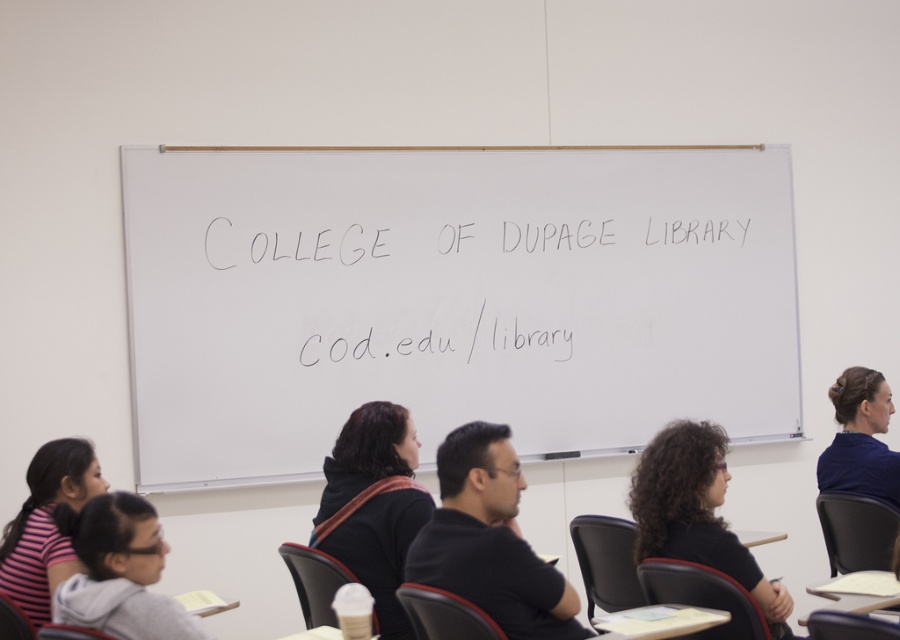
Question: Observing the image, what is the correct spatial positioning of black matte shirt at center in reference to black matte jacket at center?

Choices:
 (A) above
 (B) below

Answer: (B)

Question: Is white chalk writing at center to the left of black matte shirt at center from the viewer's perspective?

Choices:
 (A) no
 (B) yes

Answer: (A)

Question: Which point is closer to the camera taking this photo?

Choices:
 (A) (369, 584)
 (B) (560, 588)
 (C) (159, 532)
 (D) (307, 305)

Answer: (B)

Question: Which object is farther from the camera taking this photo?

Choices:
 (A) black matte jacket at center
 (B) black matte shirt at center

Answer: (A)

Question: Which of the following is the farthest from the observer?

Choices:
 (A) (464, 525)
 (B) (549, 307)
 (C) (349, 545)
 (D) (58, 506)

Answer: (B)

Question: Is white chalk writing at center to the right of gray hoodie at lower left from the viewer's perspective?

Choices:
 (A) yes
 (B) no

Answer: (A)